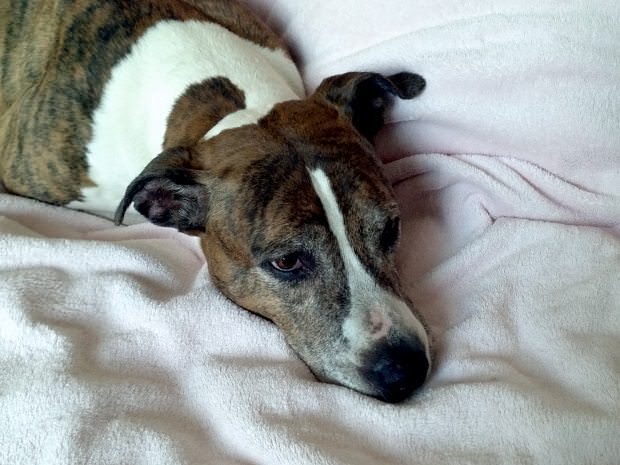
Where is `white fur`? white fur is located at coordinates (131, 105), (279, 76).